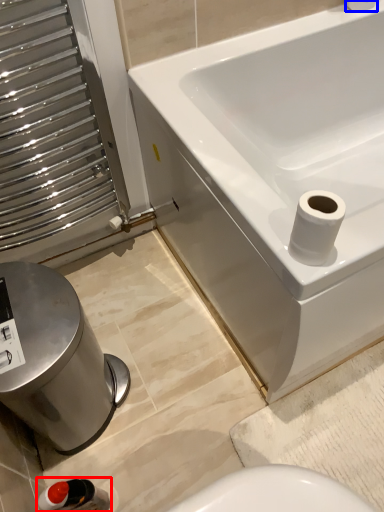
Question: Which point is closer to the camera, plumbing fixture (highlighted by a red box) or toilet paper (highlighted by a blue box)?

Choices:
 (A) plumbing fixture
 (B) toilet paper

Answer: (A)